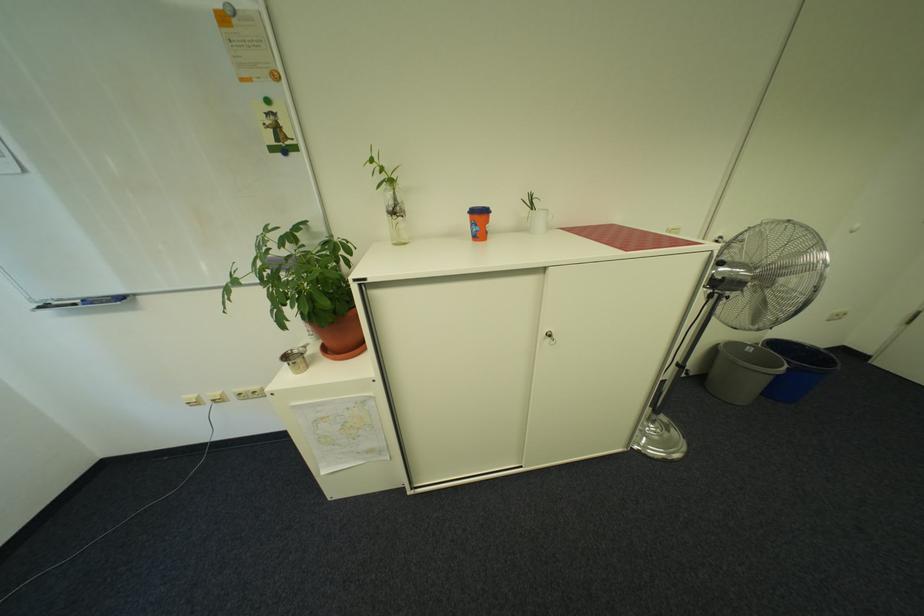
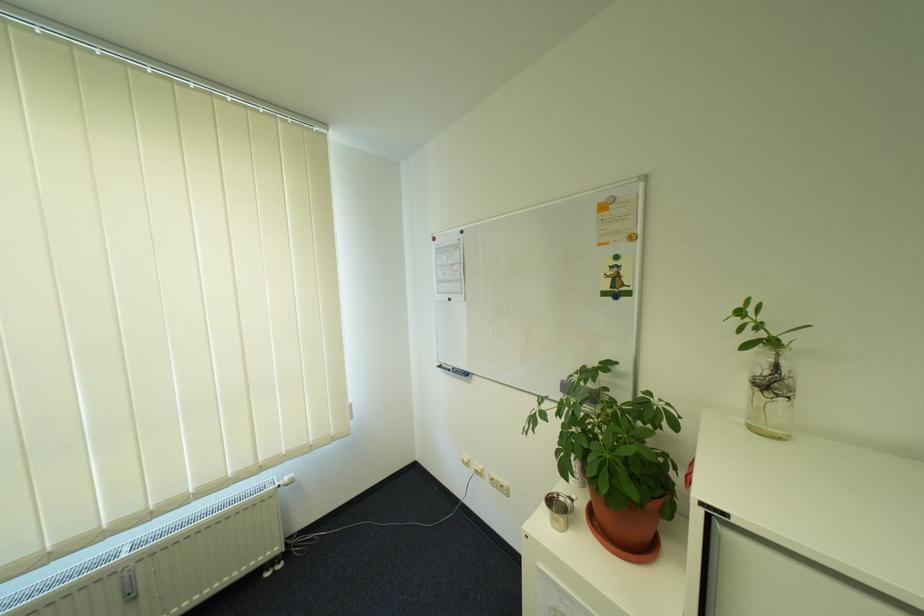
Where in the second image is the point corresponding to (x=305, y=352) from the first image?

(572, 500)